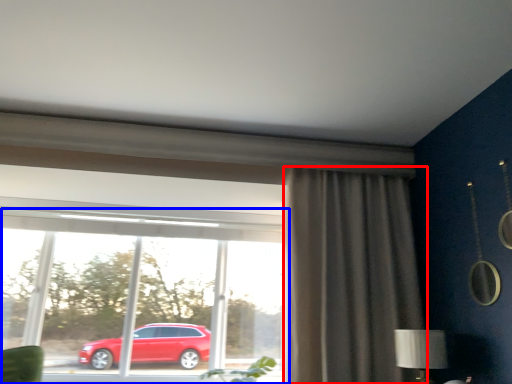
Question: Which object appears closest to the camera in this image, curtain (highlighted by a red box) or window (highlighted by a blue box)?

Choices:
 (A) curtain
 (B) window

Answer: (A)